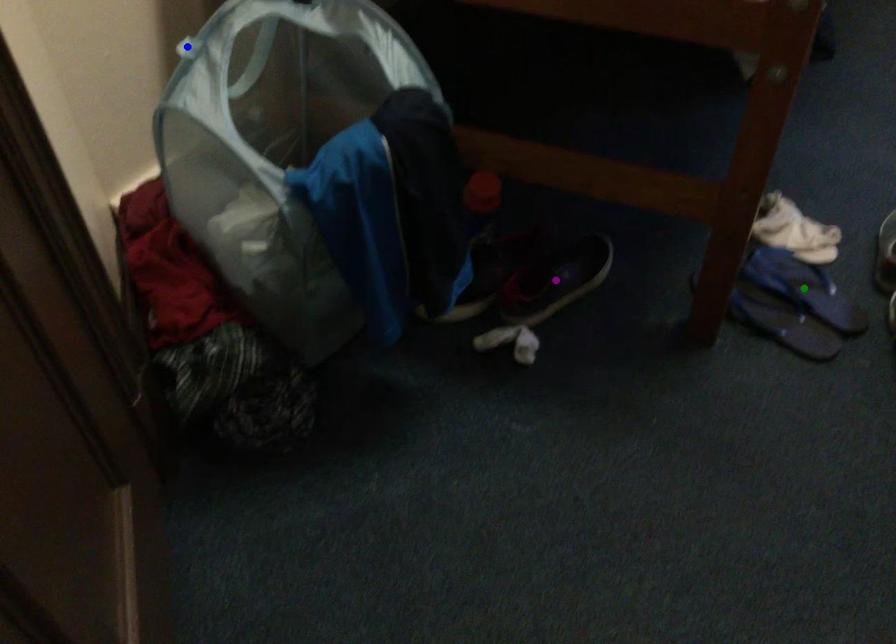
Order these from farthest to nearest:
blue point | purple point | green point

purple point, green point, blue point